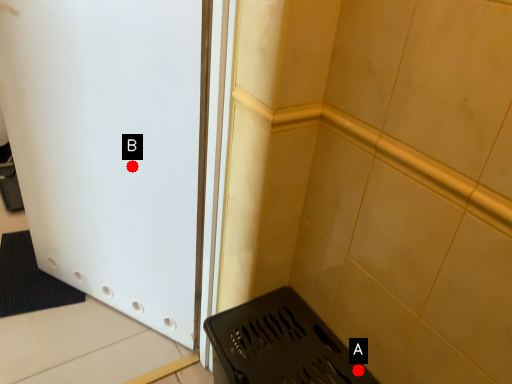
Question: Two points are circled on the image, labeled by A and B beside each circle. Which point is closer to the camera?

Choices:
 (A) A is closer
 (B) B is closer

Answer: (A)